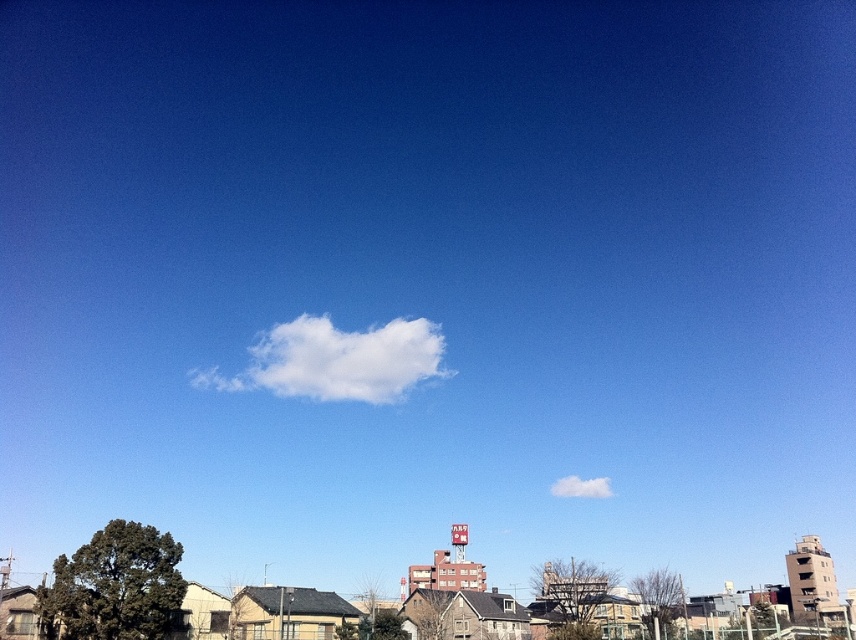
You are an airplane pilot looking at the sky in the scene. You notice two white fluffy clouds. Which one is higher in the sky between the white fluffy cloud at center and the white fluffy cloud at upper center?

The white fluffy cloud at upper center is higher in the sky because it is positioned higher than the white fluffy cloud at center.